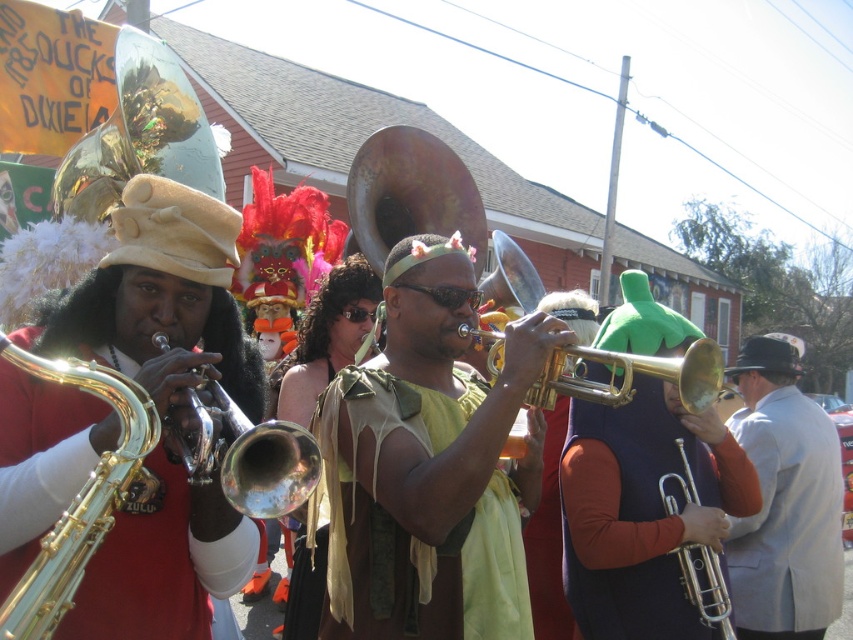
Is shiny brass saxophone at left wider than gray wool suit at right?

Indeed, shiny brass saxophone at left has a greater width compared to gray wool suit at right.

Is shiny brass saxophone at left to the left of gray wool suit at right from the viewer's perspective?

Correct, you'll find shiny brass saxophone at left to the left of gray wool suit at right.

Is point (42, 400) positioned behind point (811, 410)?

No, (42, 400) is closer to viewer.

Image resolution: width=853 pixels, height=640 pixels. In order to click on shiny brass saxophone at left in this screenshot , I will do `click(161, 300)`.

Describe the element at coordinates (642, 509) in the screenshot. I see `velvet green vest at center` at that location.

Who is more forward, (582, 620) or (547, 368)?

Positioned in front is point (547, 368).

Where is `velvet green vest at center`? velvet green vest at center is located at coordinates (642, 509).

Is point (561, 381) positioned after point (222, 465)?

Yes.

Is point (498, 372) in front of point (248, 429)?

No.

Is point (666, 378) farther from viewer compared to point (283, 497)?

Yes, it is behind point (283, 497).

What are the coordinates of `gold shiny trumpet at center` in the screenshot? It's located at (630, 376).